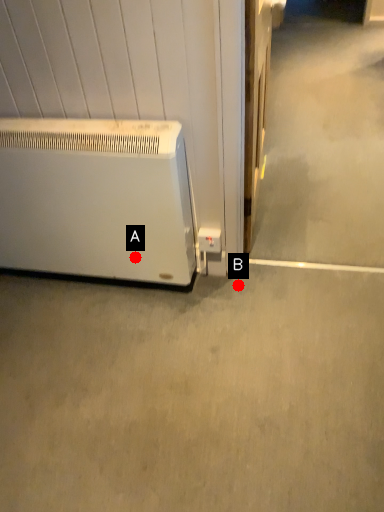
Question: Two points are circled on the image, labeled by A and B beside each circle. Which of the following is the farthest from the observer?

Choices:
 (A) A is further
 (B) B is further

Answer: (B)